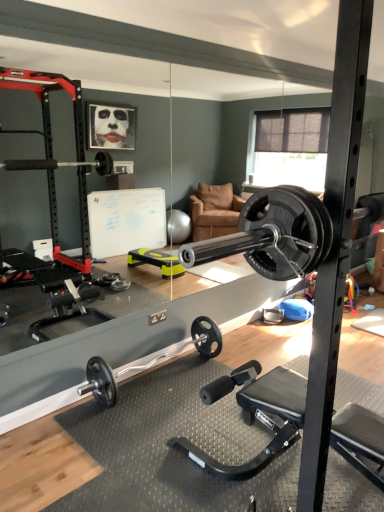
Where is `vacant region to the right of black rubber dumbbell at center`? The width and height of the screenshot is (384, 512). vacant region to the right of black rubber dumbbell at center is located at coordinates (249, 383).